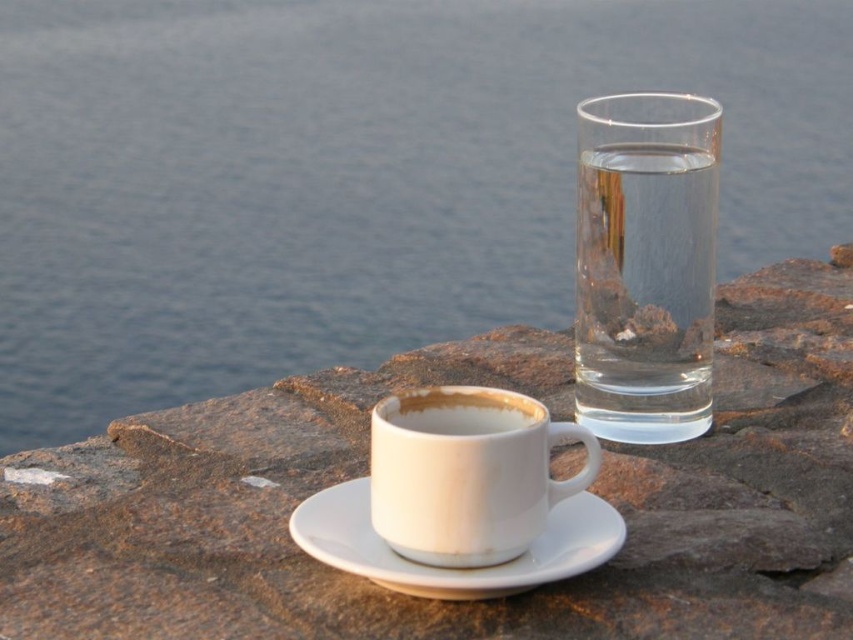
Question: Which point appears closest to the camera in this image?

Choices:
 (A) (38, 554)
 (B) (601, 369)
 (C) (432, 432)
 (D) (210, 33)

Answer: (C)

Question: Which point is closer to the camera taking this photo?

Choices:
 (A) (508, 403)
 (B) (309, 497)
 (C) (648, 179)

Answer: (A)

Question: Is transparent glass water at upper right to the left of white ceramic saucer at center from the viewer's perspective?

Choices:
 (A) no
 (B) yes

Answer: (A)

Question: Is white ceramic mug at center positioned in front of white ceramic saucer at center?

Choices:
 (A) yes
 (B) no

Answer: (B)

Question: Can you confirm if transparent glass water at upper right is bigger than white ceramic mug at center?

Choices:
 (A) no
 (B) yes

Answer: (B)

Question: Among these objects, which one is nearest to the camera?

Choices:
 (A) white ceramic saucer at center
 (B) transparent glass water at upper right
 (C) white matte stone at center

Answer: (A)